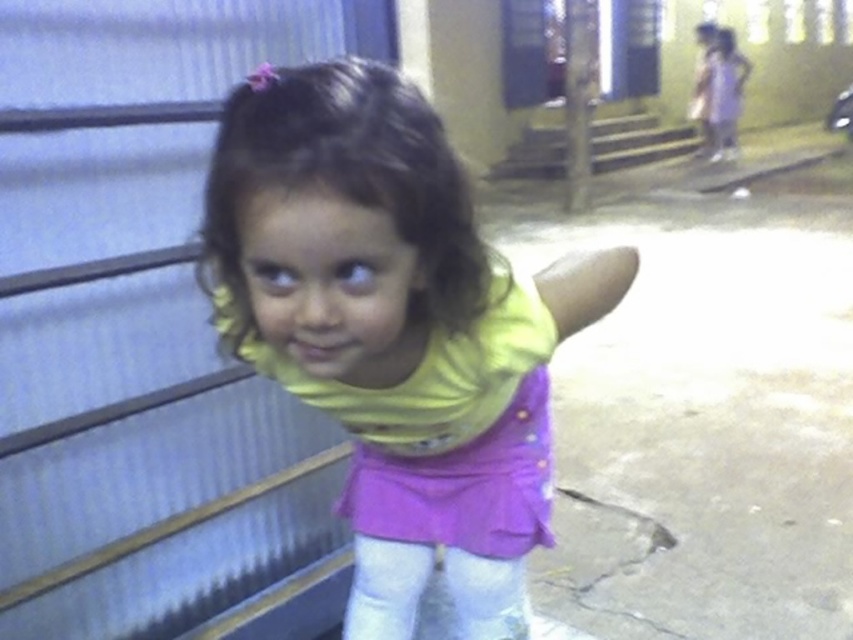
Is metallic gray garage door at upper left closer to the viewer compared to yellow matte shirt at center?

No, it is behind yellow matte shirt at center.

Is metallic gray garage door at upper left shorter than yellow matte shirt at center?

Incorrect, metallic gray garage door at upper left's height does not fall short of yellow matte shirt at center's.

Is point (163, 0) more distant than point (401, 333)?

That is True.

Locate an element on the screen. The width and height of the screenshot is (853, 640). metallic gray garage door at upper left is located at coordinates (137, 312).